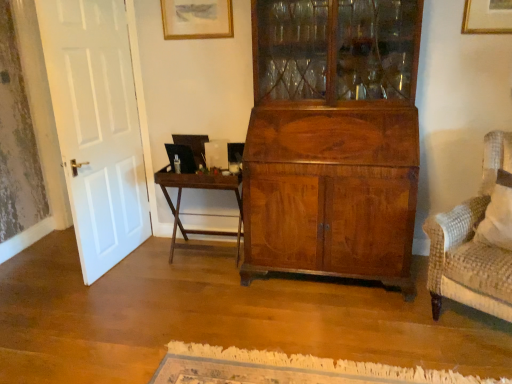
The height and width of the screenshot is (384, 512). Describe the element at coordinates (199, 188) in the screenshot. I see `dark brown wood table at center` at that location.

You are a GUI agent. You are given a task and a screenshot of the screen. Output one action in this format:
    pyautogui.click(x=<x>, y=<y>)
    Task: Click on the dark brown wood table at center
    Image resolution: width=512 pixels, height=384 pixels.
    Given the screenshot: What is the action you would take?
    pyautogui.click(x=199, y=188)

What do you see at coordinates (197, 19) in the screenshot?
I see `matte gold picture frame at upper center` at bounding box center [197, 19].

Locate an element on the screen. matte gold picture frame at upper center is located at coordinates (197, 19).

Measure the distance between point [188,23] and camera.

Point [188,23] and camera are 9.78 feet apart from each other.

Where is `dark brown wood table at center`? dark brown wood table at center is located at coordinates (199, 188).

Which is more to the right, matte gold picture frame at upper center or dark brown wood table at center?

dark brown wood table at center is more to the right.

Is matte gold picture frame at upper center further to camera compared to dark brown wood table at center?

Yes, matte gold picture frame at upper center is behind dark brown wood table at center.

Does point (213, 9) lie in front of point (241, 206)?

Yes, point (213, 9) is in front of point (241, 206).

From the image's perspective, is matte gold picture frame at upper center under dark brown wood table at center?

No, from the image's perspective, matte gold picture frame at upper center is not below dark brown wood table at center.

From a real-world perspective, relative to dark brown wood table at center, is matte gold picture frame at upper center vertically above or below?

In terms of real-world spatial position, matte gold picture frame at upper center is above dark brown wood table at center.

Which object is wider, matte gold picture frame at upper center or dark brown wood table at center?

With larger width is dark brown wood table at center.

In terms of height, does matte gold picture frame at upper center look taller or shorter compared to dark brown wood table at center?

matte gold picture frame at upper center is shorter than dark brown wood table at center.

Based on their sizes in the image, would you say matte gold picture frame at upper center is bigger or smaller than dark brown wood table at center?

Clearly, matte gold picture frame at upper center is smaller in size than dark brown wood table at center.

Is matte gold picture frame at upper center positioned beyond the bounds of dark brown wood table at center?

Indeed, matte gold picture frame at upper center is completely outside dark brown wood table at center.

Is matte gold picture frame at upper center next to dark brown wood table at center?

No, matte gold picture frame at upper center is not in contact with dark brown wood table at center.

Does matte gold picture frame at upper center turn towards dark brown wood table at center?

No, matte gold picture frame at upper center is not oriented towards dark brown wood table at center.

How different are the orientations of matte gold picture frame at upper center and dark brown wood table at center in degrees?

The angular difference between matte gold picture frame at upper center and dark brown wood table at center is 0.383 degrees.

The height and width of the screenshot is (384, 512). Find the location of `picture frame above the dark brown wood table at center (from the image's perspective)`. picture frame above the dark brown wood table at center (from the image's perspective) is located at coordinates (197, 19).

Is dark brown wood table at center at the right side of matte gold picture frame at upper center?

Indeed, dark brown wood table at center is positioned on the right side of matte gold picture frame at upper center.

In the scene shown: Is dark brown wood table at center closer to camera compared to matte gold picture frame at upper center?

Yes, dark brown wood table at center is in front of matte gold picture frame at upper center.

Considering the points (175, 209) and (230, 2), which point is behind, point (175, 209) or point (230, 2)?

The point (175, 209) is farther.

From the image's perspective, is dark brown wood table at center located above matte gold picture frame at upper center?

No, from the image's perspective, dark brown wood table at center is not on top of matte gold picture frame at upper center.

From a real-world perspective, does dark brown wood table at center stand above matte gold picture frame at upper center?

No, from a real-world perspective, dark brown wood table at center is not over matte gold picture frame at upper center

Which of these two, dark brown wood table at center or matte gold picture frame at upper center, is thinner?

With smaller width is matte gold picture frame at upper center.

Which of these two, dark brown wood table at center or matte gold picture frame at upper center, stands shorter?

Standing shorter between the two is matte gold picture frame at upper center.

Considering the sizes of objects dark brown wood table at center and matte gold picture frame at upper center in the image provided, who is bigger, dark brown wood table at center or matte gold picture frame at upper center?

dark brown wood table at center is bigger.

Is dark brown wood table at center surrounding matte gold picture frame at upper center?

No, matte gold picture frame at upper center is not a part of dark brown wood table at center.

Is there a large distance between dark brown wood table at center and matte gold picture frame at upper center?

Yes.

Is dark brown wood table at center oriented towards matte gold picture frame at upper center?

No, dark brown wood table at center is not facing towards matte gold picture frame at upper center.

What's the angular difference between dark brown wood table at center and matte gold picture frame at upper center's facing directions?

The facing directions of dark brown wood table at center and matte gold picture frame at upper center are 0.383 degrees apart.

How much distance is there between dark brown wood table at center and matte gold picture frame at upper center?

They are 1.13 meters apart.

Find the location of `picture frame that appears above the dark brown wood table at center (from the image's perspective)`. picture frame that appears above the dark brown wood table at center (from the image's perspective) is located at coordinates (197, 19).

At what (x,y) coordinates should I click in order to perform the action: click on table on the right side of matte gold picture frame at upper center. Please return your answer as a coordinate pair (x, y). Looking at the image, I should click on (199, 188).

Where is `picture frame above the dark brown wood table at center (from the image's perspective)`? The height and width of the screenshot is (384, 512). picture frame above the dark brown wood table at center (from the image's perspective) is located at coordinates (197, 19).